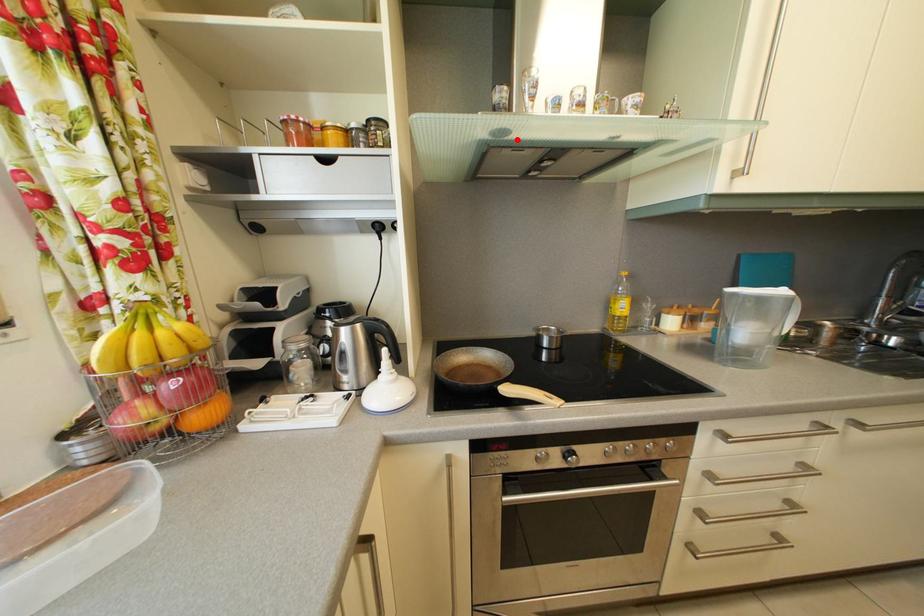
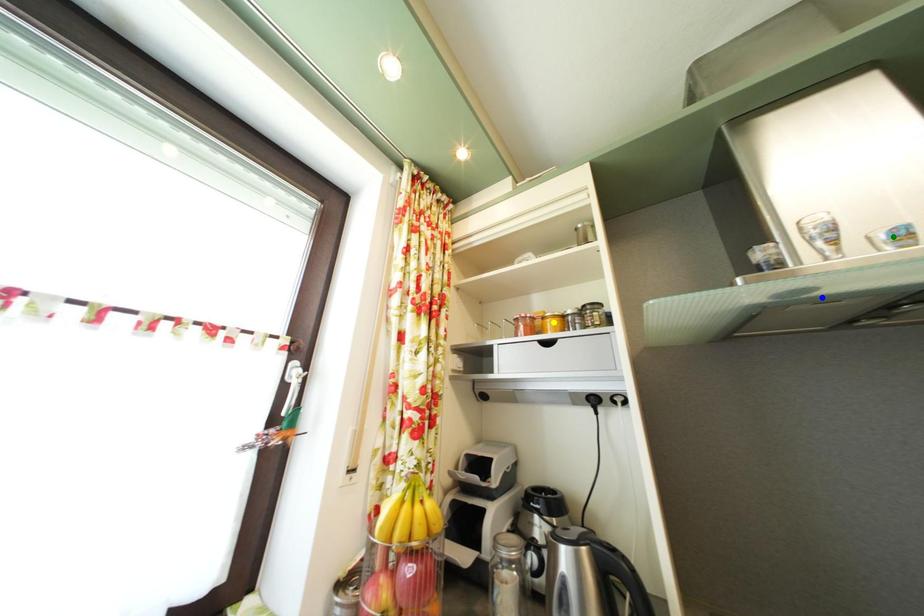
Question: I am providing you with two images of the same scene from different viewpoints. A red point is marked on the first image. You are given multiple points on the second image. Which point in image 2 represents the same 3d spot as the red point in image 1?

Choices:
 (A) yellow point
 (B) green point
 (C) blue point

Answer: (C)